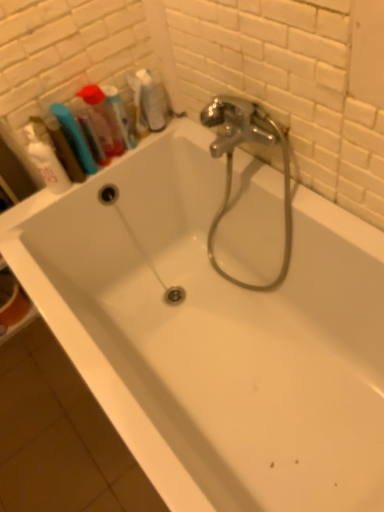
Question: Would you say white matte shaving cream at upper left is a long distance from translucent plastic mouthwash at upper left, the first mouthwash when ordered from left to right?

Choices:
 (A) no
 (B) yes

Answer: (A)

Question: Can you confirm if white matte shaving cream at upper left is positioned to the right of translucent plastic mouthwash at upper left, positioned as the third mouthwash in right-to-left order?

Choices:
 (A) no
 (B) yes

Answer: (A)

Question: Does white matte shaving cream at upper left have a smaller size compared to translucent plastic mouthwash at upper left, the first mouthwash when ordered from left to right?

Choices:
 (A) no
 (B) yes

Answer: (A)

Question: Does white matte shaving cream at upper left have a larger size compared to translucent plastic mouthwash at upper left, the first mouthwash when ordered from left to right?

Choices:
 (A) yes
 (B) no

Answer: (A)

Question: Is white matte shaving cream at upper left oriented towards translucent plastic mouthwash at upper left, positioned as the third mouthwash in right-to-left order?

Choices:
 (A) yes
 (B) no

Answer: (B)

Question: Are white matte shaving cream at upper left and translucent plastic mouthwash at upper left, positioned as the third mouthwash in right-to-left order, beside each other?

Choices:
 (A) no
 (B) yes

Answer: (B)

Question: Does translucent plastic container at upper left have a larger size compared to translucent plastic mouthwash at upper left, which is counted as the second mouthwash, starting from the left?

Choices:
 (A) yes
 (B) no

Answer: (A)

Question: From a real-world perspective, is translucent plastic container at upper left on top of translucent plastic mouthwash at upper left, the 2th mouthwash when ordered from right to left?

Choices:
 (A) no
 (B) yes

Answer: (B)

Question: Is translucent plastic container at upper left further to the viewer compared to translucent plastic mouthwash at upper left, the 2th mouthwash when ordered from right to left?

Choices:
 (A) yes
 (B) no

Answer: (B)

Question: From a real-world perspective, is translucent plastic container at upper left located beneath translucent plastic mouthwash at upper left, which is counted as the second mouthwash, starting from the left?

Choices:
 (A) no
 (B) yes

Answer: (A)

Question: Are translucent plastic container at upper left and translucent plastic mouthwash at upper left, the 2th mouthwash when ordered from right to left, far apart?

Choices:
 (A) no
 (B) yes

Answer: (A)

Question: Is translucent plastic container at upper left positioned beyond the bounds of translucent plastic mouthwash at upper left, the 2th mouthwash when ordered from right to left?

Choices:
 (A) no
 (B) yes

Answer: (B)

Question: Can you confirm if white matte shaving cream at upper left is smaller than translucent plastic mouthwash at upper left, which is counted as the second mouthwash, starting from the left?

Choices:
 (A) no
 (B) yes

Answer: (A)